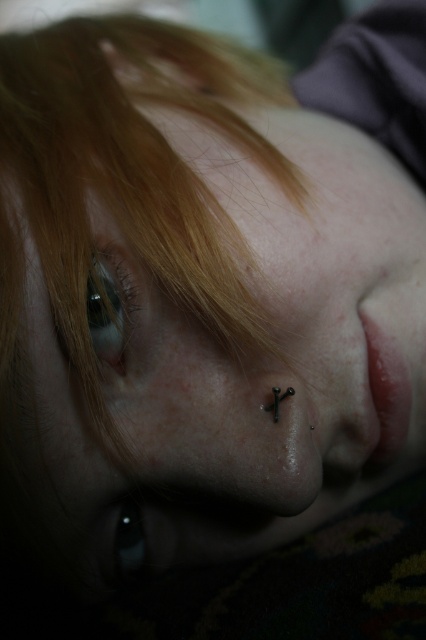
Does matte black eye at upper left have a larger size compared to black glossy eye at lower left?

Indeed, matte black eye at upper left has a larger size compared to black glossy eye at lower left.

Is matte black eye at upper left positioned before black glossy eye at lower left?

Yes, matte black eye at upper left is closer to the viewer.

This screenshot has height=640, width=426. Describe the element at coordinates (108, 308) in the screenshot. I see `matte black eye at upper left` at that location.

At what (x,y) coordinates should I click in order to perform the action: click on matte black eye at upper left. Please return your answer as a coordinate pair (x, y). This screenshot has width=426, height=640. Looking at the image, I should click on (108, 308).